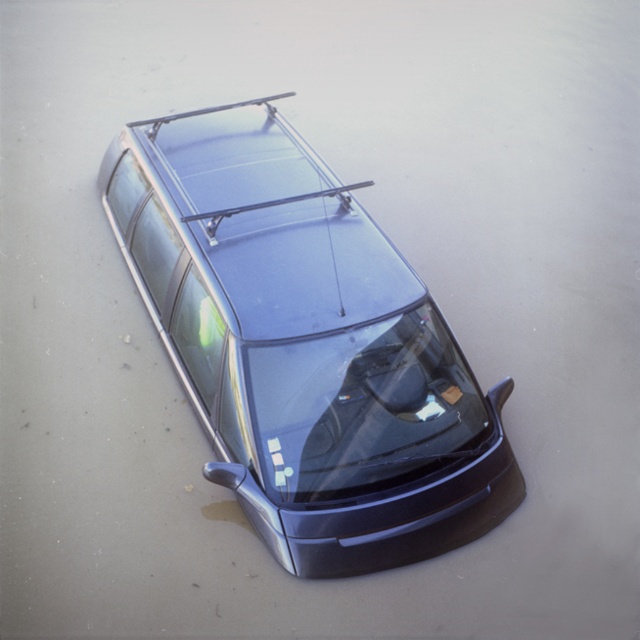
Between satin black car at center and transparent glass windshield at center, which one has less height?

Standing shorter between the two is transparent glass windshield at center.

Can you confirm if satin black car at center is positioned above transparent glass windshield at center?

Correct, satin black car at center is located above transparent glass windshield at center.

Is point (348, 556) positioned before point (410, 321)?

That is True.

At what (x,y) coordinates should I click in order to perform the action: click on satin black car at center. Please return your answer as a coordinate pair (x, y). Image resolution: width=640 pixels, height=640 pixels. Looking at the image, I should click on (305, 346).